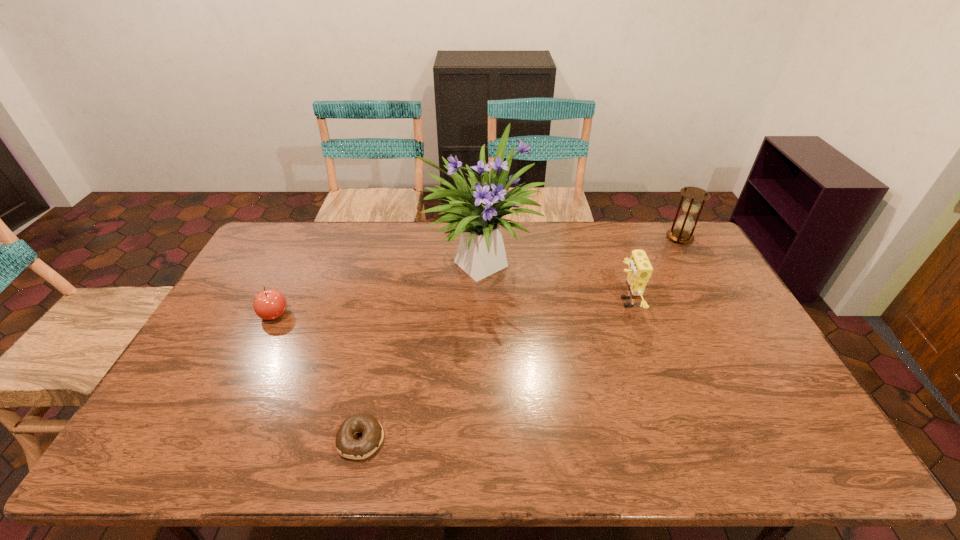
Where is `free space between the fourth object from left to right and the leftmost object`? free space between the fourth object from left to right and the leftmost object is located at coordinates [450, 308].

I want to click on unoccupied area between the shortest object and the sponge, so pos(493,370).

Where is `free space that is in between the third object from left to right and the sponge`? The image size is (960, 540). free space that is in between the third object from left to right and the sponge is located at coordinates (554, 280).

Image resolution: width=960 pixels, height=540 pixels. I want to click on free area in between the fourth tallest object and the fourth object from right to left, so click(x=318, y=377).

At what (x,y) coordinates should I click in order to perform the action: click on free spot between the shortest object and the hourglass. Please return your answer as a coordinate pair (x, y). Looking at the image, I should click on (520, 339).

In order to click on object that is the second nearest to the tallest object in this screenshot , I will do (270, 304).

Identify which object is the second nearest to the leftmost object. Please provide its 2D coordinates. Your answer should be formatted as a tuple, i.e. [(x, y)], where the tuple contains the x and y coordinates of a point satisfying the conditions above.

[(347, 446)]

The height and width of the screenshot is (540, 960). Identify the location of free point that satisfies the following two spatial constraints: 1. on the front side of the doughnut; 2. on the left side of the apple. (213, 440).

The height and width of the screenshot is (540, 960). Find the location of `blank space that satisfies the following two spatial constraints: 1. on the back side of the hourglass; 2. on the right side of the fourth object from right to left`. blank space that satisfies the following two spatial constraints: 1. on the back side of the hourglass; 2. on the right side of the fourth object from right to left is located at coordinates (405, 238).